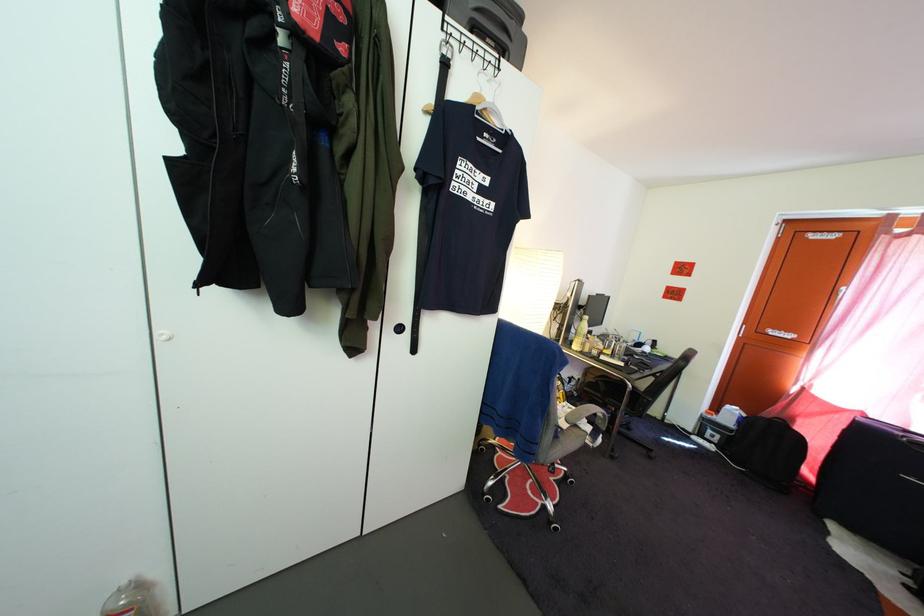
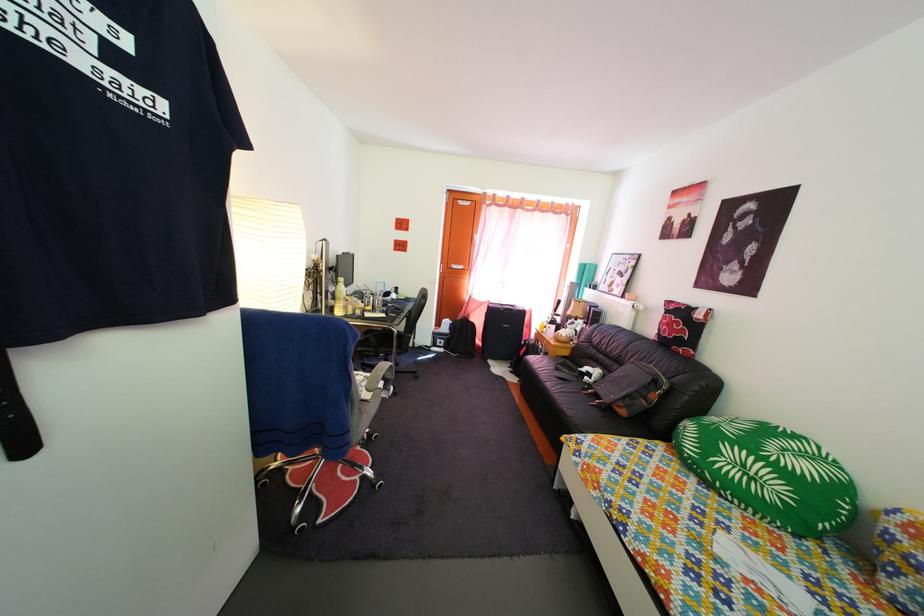
Question: Based on the continuous images, in which direction is the camera rotating? Reply with the corresponding letter.

Choices:
 (A) Left
 (B) Right
 (C) Up
 (D) Down

Answer: (B)